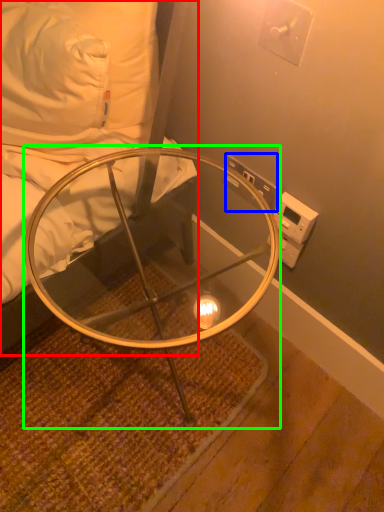
Question: Considering the real-world distances, which object is farthest from furniture (highlighted by a red box)? electric outlet (highlighted by a blue box) or table (highlighted by a green box)?

Choices:
 (A) electric outlet
 (B) table

Answer: (A)